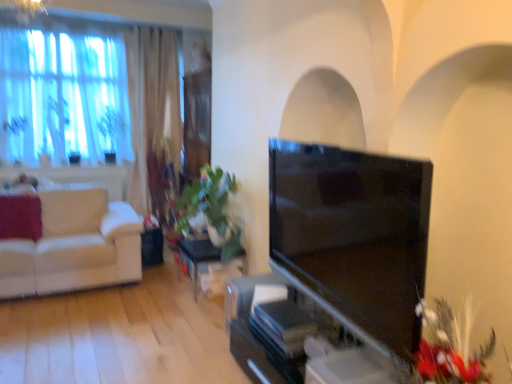
Question: Considering the positions of point (477, 362) and point (407, 311), is point (477, 362) closer or farther from the camera than point (407, 311)?

Choices:
 (A) farther
 (B) closer

Answer: (A)

Question: Based on their sizes in the image, would you say fluffy red flowers at lower right is bigger or smaller than matte black tv at center?

Choices:
 (A) small
 (B) big

Answer: (A)

Question: Estimate the real-world distances between objects in this image. Which object is farther from the green leafy plant at upper left?

Choices:
 (A) fluffy red flowers at lower right
 (B) white fabric couch at left
 (C) matte black tv at center
 (D) green glossy table at center
 (E) green leafy plant at center

Answer: (A)

Question: Estimate the real-world distances between objects in this image. Which object is farther from the green glossy table at center?

Choices:
 (A) green leafy plant at center
 (B) white fabric couch at left
 (C) matte black tv at center
 (D) green leafy plant at upper left
 (E) fluffy red flowers at lower right

Answer: (D)